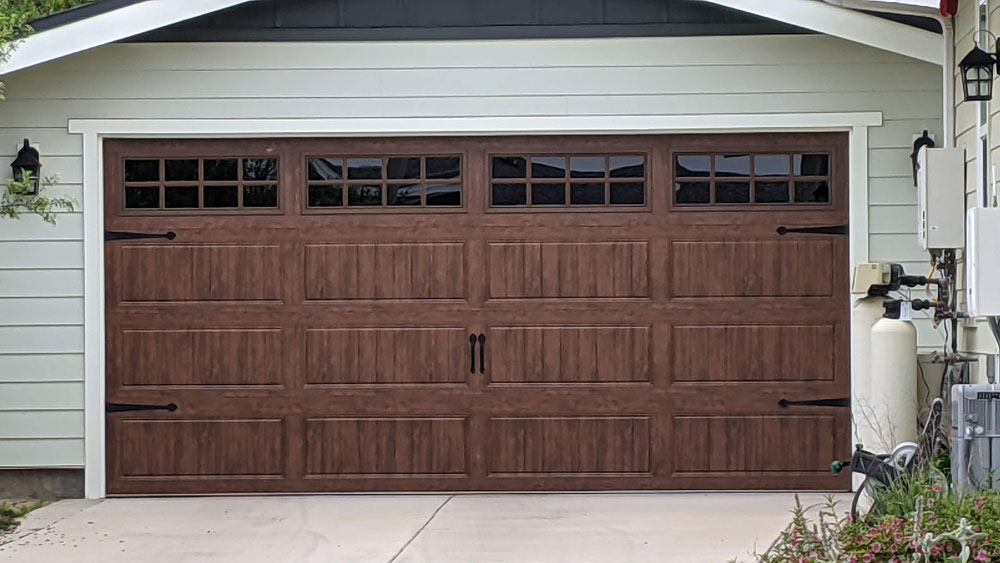
Identify the location of garage window. The width and height of the screenshot is (1000, 563). (198, 177), (404, 171), (576, 172), (760, 182).